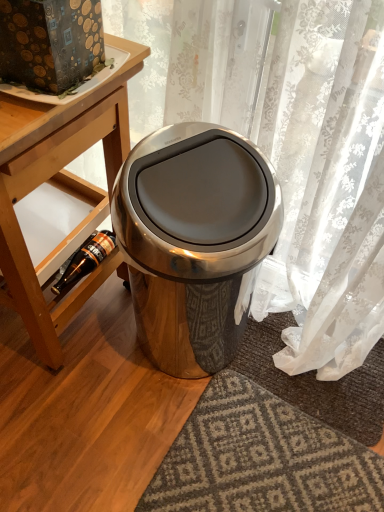
Question: Is wooden shelf at lower left to the left or to the right of satin metallic trash can at center in the image?

Choices:
 (A) right
 (B) left

Answer: (B)

Question: Does point (105, 207) appear closer or farther from the camera than point (188, 226)?

Choices:
 (A) farther
 (B) closer

Answer: (A)

Question: Estimate the real-world distances between objects in this image. Which object is farther from the brown glass bottle at lower left?

Choices:
 (A) wooden shelf at lower left
 (B) wooden table at lower left
 (C) satin metallic trash can at center

Answer: (C)

Question: Estimate the real-world distances between objects in this image. Which object is closer to the brown glass bottle at lower left?

Choices:
 (A) satin metallic trash can at center
 (B) wooden shelf at lower left
 (C) wooden table at lower left

Answer: (B)